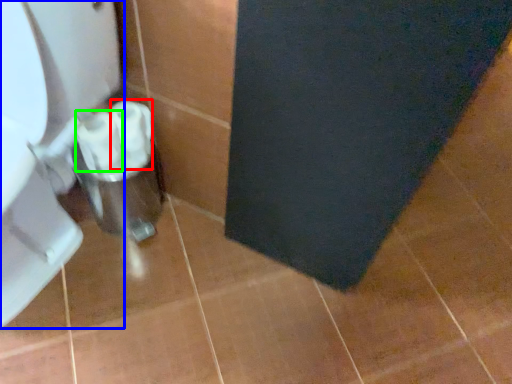
Question: Estimate the real-world distances between objects in this image. Which object is farther from toilet paper (highlighted by a red box), toilet (highlighted by a blue box) or toilet paper (highlighted by a green box)?

Choices:
 (A) toilet
 (B) toilet paper

Answer: (A)